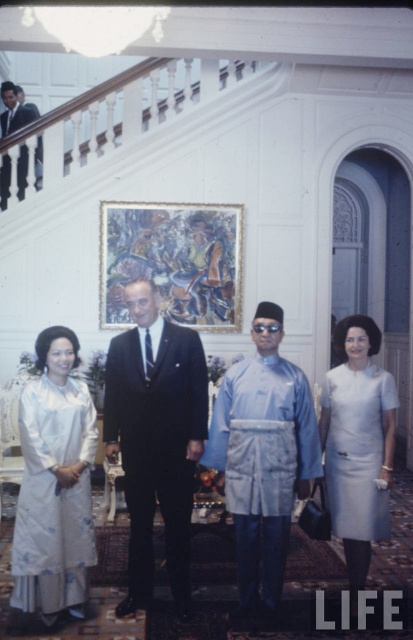
Measure the distance between light blue silk robe at center and white satin dress at right.

light blue silk robe at center is 37.40 centimeters from white satin dress at right.

Who is positioned more to the right, light blue silk robe at center or white satin dress at right?

white satin dress at right

The image size is (413, 640). What do you see at coordinates (263, 456) in the screenshot? I see `light blue silk robe at center` at bounding box center [263, 456].

At what (x,y) coordinates should I click in order to perform the action: click on light blue silk robe at center. Please return your answer as a coordinate pair (x, y). The width and height of the screenshot is (413, 640). Looking at the image, I should click on [263, 456].

Can you confirm if light blue silk robe at center is positioned below dark suit at upper left?

Yes, light blue silk robe at center is below dark suit at upper left.

Who is taller, light blue silk robe at center or dark suit at upper left?

light blue silk robe at center

The height and width of the screenshot is (640, 413). In order to click on light blue silk robe at center in this screenshot , I will do `click(263, 456)`.

Is light blue silk robe at center bigger than silky white dress at lower left?

Correct, light blue silk robe at center is larger in size than silky white dress at lower left.

Is light blue silk robe at center taller than silky white dress at lower left?

Yes.

Who is more forward, [235,532] or [71,356]?

Point [235,532] is more forward.

You are a GUI agent. You are given a task and a screenshot of the screen. Output one action in this format:
    pyautogui.click(x=<x>, y=<y>)
    Task: Click on the light blue silk robe at center
    This screenshot has width=413, height=640.
    Given the screenshot: What is the action you would take?
    pyautogui.click(x=263, y=456)